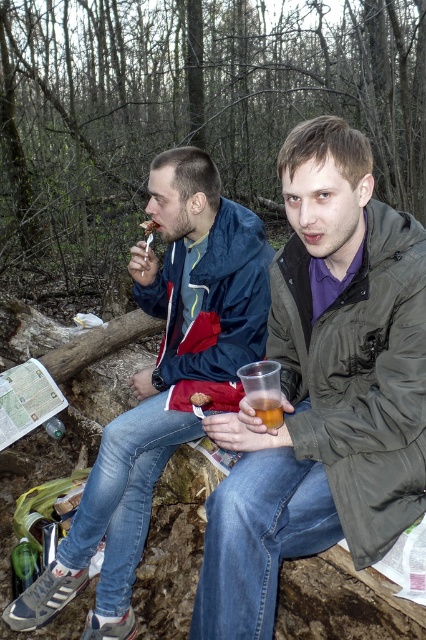
Question: Estimate the real-world distances between objects in this image. Which object is farther from the green matte jacket at center?

Choices:
 (A) translucent plastic cup at lower center
 (B) matte plastic spoon at upper left
 (C) matte blue jacket at left

Answer: (B)

Question: Which point is closer to the camera taking this photo?

Choices:
 (A) (236, 323)
 (B) (201, 401)
 (C) (253, 384)
 (D) (236, 534)

Answer: (D)

Question: Does matte blue jacket at left have a smaller size compared to matte brown bread at center?

Choices:
 (A) no
 (B) yes

Answer: (A)

Question: Does translucent plastic cup at lower center appear over matte plastic spoon at upper left?

Choices:
 (A) no
 (B) yes

Answer: (A)

Question: Which point is farther from the camera taking this photo?

Choices:
 (A) (195, 396)
 (B) (229, 225)
 (C) (154, 220)
 (D) (250, 483)

Answer: (C)

Question: Is green matte jacket at center bigger than matte brown bread at center?

Choices:
 (A) yes
 (B) no

Answer: (A)